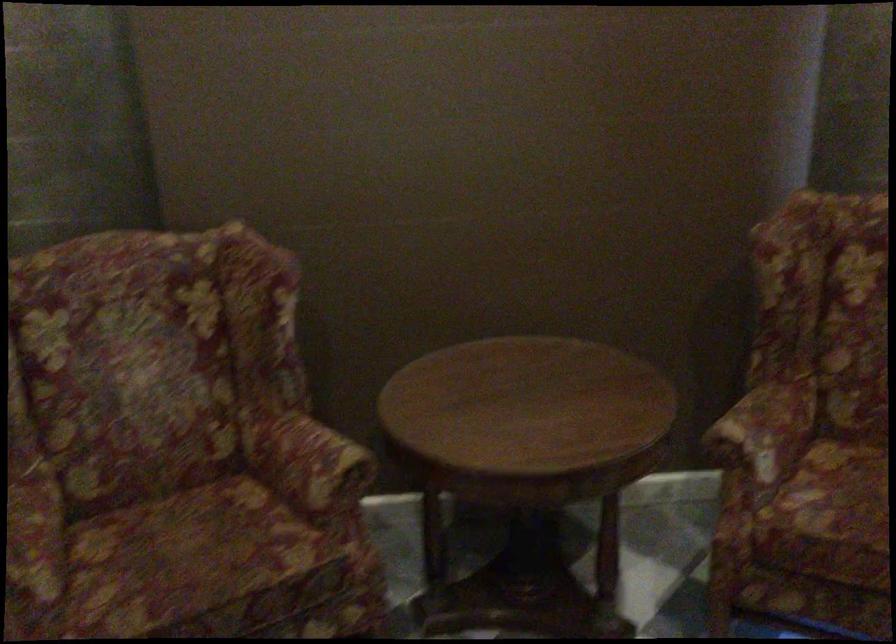
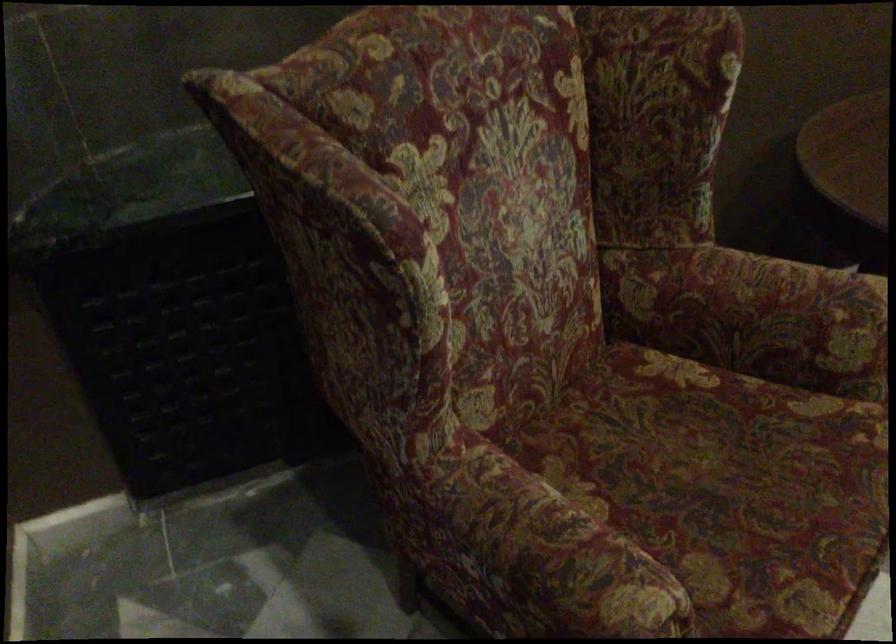
Where in the second image is the point corresponding to point (177, 556) from the first image?

(726, 486)